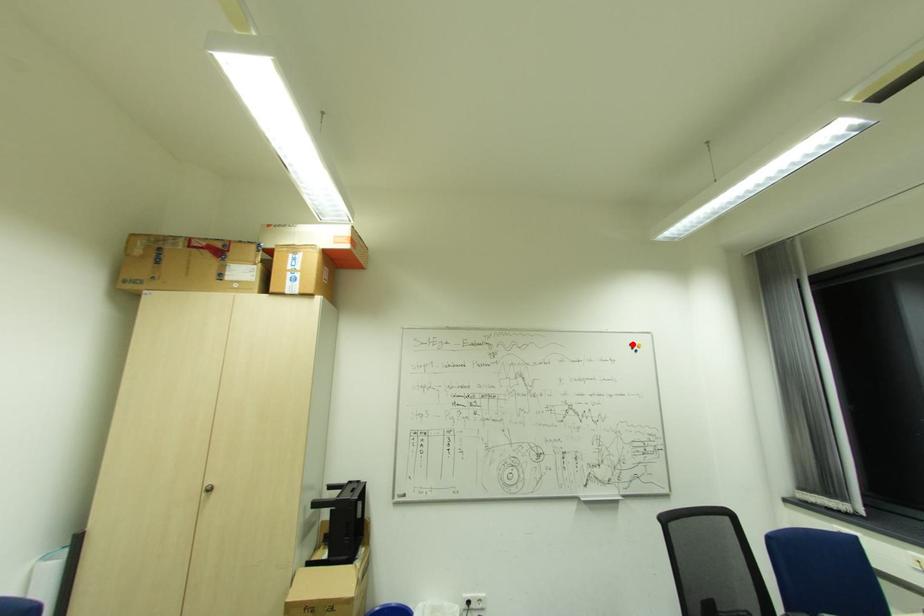
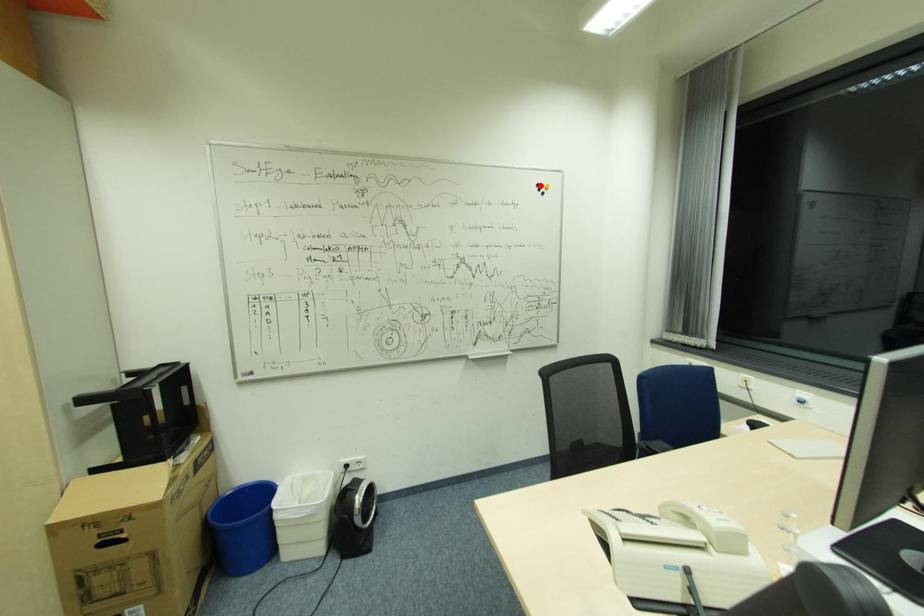
I am providing you with two images of the same scene from different viewpoints. A red point is marked on the first image and another point is marked on the second image. Is the red point in image1 aligned with the point shown in image2?

Yes